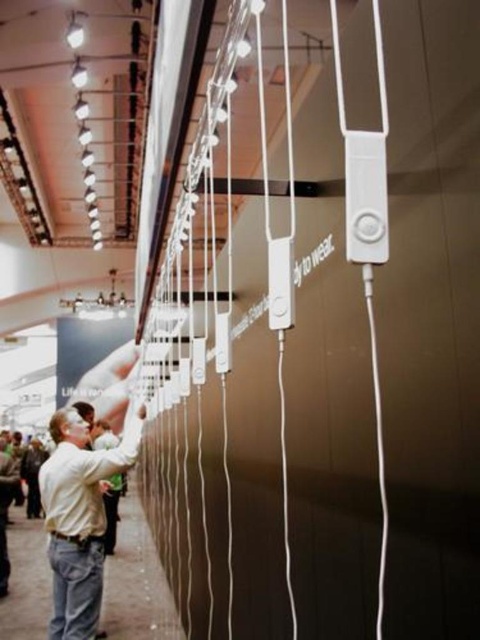
You are an event organizer setting up a booth at the trade show. You have two shirts to display, the white matte shirt at center and the light beige shirt at lower left. Which shirt should you place on the taller display stand to match their sizes?

The white matte shirt at center is much taller than the light beige shirt at lower left, so you should place the white matte shirt at center on the taller display stand to match their sizes.

You are a fashion designer who needs to place a new dress that is 8 feet long into the exhibition space. Given the distance between the white matte shirt at center and the light beige shirt at lower left, can you fit the dress between them without folding it?

The distance between the white matte shirt at center and the light beige shirt at lower left is 10.42 feet. Since the dress is 8 feet long, it can be placed between them without folding as there is enough space.

You are an event organizer at the trade show and need to place a decorative banner between the white matte shirt at center and the light beige shirt at lower left. Which shirt should the banner be placed closer to if you want the banner to be closer to the wider shirt?

The light beige shirt at lower left is wider than the white matte shirt at center, so the banner should be placed closer to the light beige shirt at lower left.